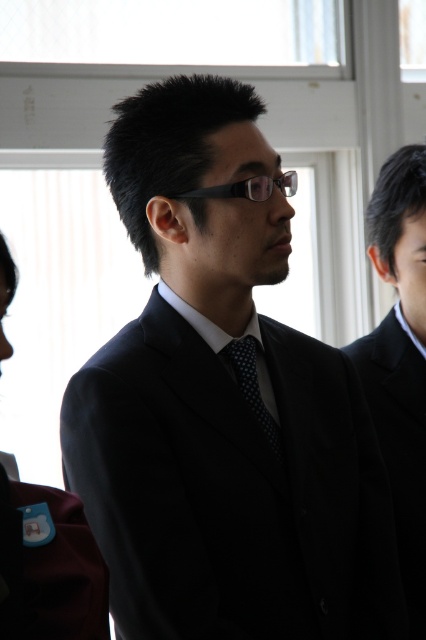
You are a photographer setting up for a group photo. The subjects are wearing a matte black suit at center and a polka dot silk tie at center. You need to ensure there is at least 10 inches between them for proper framing. Based on the scene, is the current distance sufficient?

The distance between the matte black suit at center and the polka dot silk tie at center is 8.76 inches, which is less than the required 10 inches. Therefore, the current distance is insufficient for proper framing.

You are an event planner arranging seating for a formal event. You need to seat the black matte suit at right and the maroon fabric uniform at left such that the taller individual sits in the center. Based on the image, which person should be seated in the center?

The black matte suit at right is taller than the maroon fabric uniform at left, so the black matte suit at right should be seated in the center.

You are organizing a charity event and need to arrange seating based on the guests attire. The seating chart requires that the guest in the larger attire sits closer to the stage. Given the image, which guest should be seated closer to the stage, the matte black suit at center or the maroon fabric uniform at left?

The matte black suit at center should be seated closer to the stage because it is larger in size than the maroon fabric uniform at left.